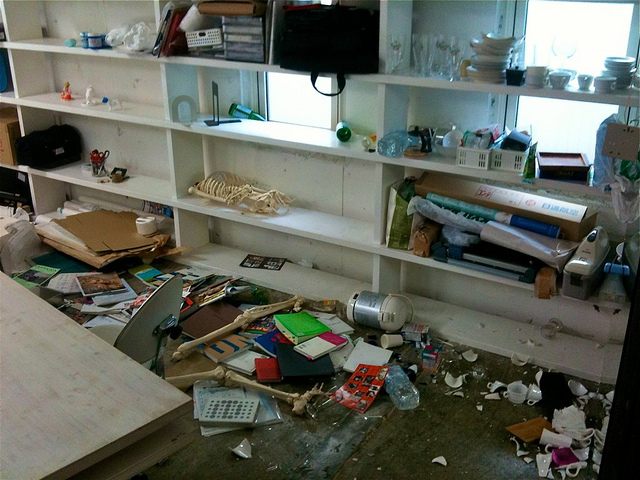
Identify the location of windows. (294, 109), (562, 121).